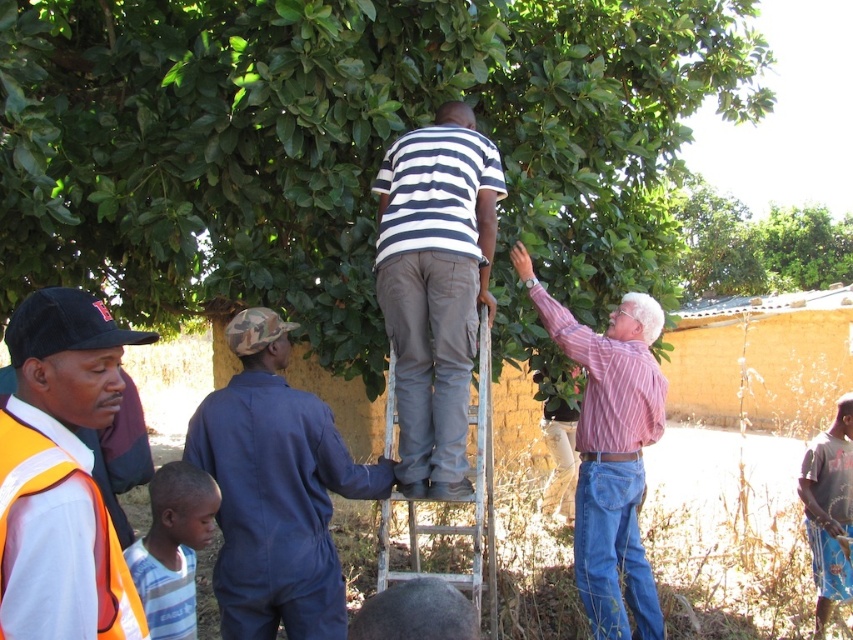
Where is `blue coveralls at center`? The width and height of the screenshot is (853, 640). blue coveralls at center is located at coordinates (276, 490).

Is blue coveralls at center thinner than orange reflective safety vest at left?

In fact, blue coveralls at center might be wider than orange reflective safety vest at left.

Is point (335, 465) farther from camera compared to point (93, 506)?

Yes, it is behind point (93, 506).

I want to click on blue coveralls at center, so click(276, 490).

Which is more to the left, pink striped shirt at upper right or metallic silver ladder at center?

metallic silver ladder at center is more to the left.

Between pink striped shirt at upper right and metallic silver ladder at center, which one has less height?

metallic silver ladder at center

Is point (625, 536) farther from viewer compared to point (486, 468)?

Yes, it is.

The width and height of the screenshot is (853, 640). In order to click on pink striped shirt at upper right in this screenshot , I will do `click(610, 451)`.

Can you confirm if blue coveralls at center is positioned to the left of pink striped shirt at upper right?

Indeed, blue coveralls at center is positioned on the left side of pink striped shirt at upper right.

Does blue coveralls at center have a lesser width compared to pink striped shirt at upper right?

No, blue coveralls at center is not thinner than pink striped shirt at upper right.

Is point (230, 486) positioned in front of point (630, 563)?

Yes, it is in front of point (630, 563).

The width and height of the screenshot is (853, 640). In order to click on blue coveralls at center in this screenshot , I will do `click(276, 490)`.